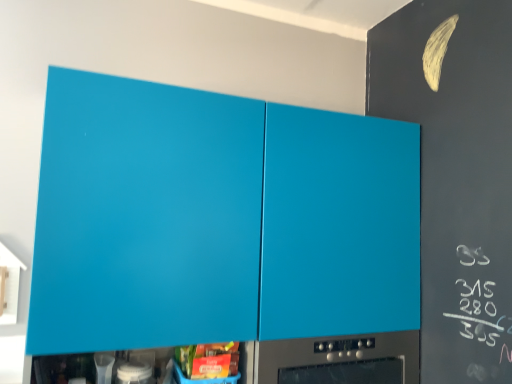
Question: Is matte plastic container at lower center inside the boundaries of matte blue cabinet at upper center, or outside?

Choices:
 (A) inside
 (B) outside

Answer: (A)

Question: Is point (203, 369) closer or farther from the camera than point (346, 155)?

Choices:
 (A) closer
 (B) farther

Answer: (A)

Question: Which of these objects is positioned farthest from the matte blue cabinet at upper center?

Choices:
 (A) white glossy container at lower center
 (B) matte plastic container at lower center
 (C) satin black oven at lower center

Answer: (A)

Question: Estimate the real-world distances between objects in this image. Which object is farther from the matte blue cabinet at upper center?

Choices:
 (A) white glossy container at lower center
 (B) matte plastic container at lower center
 (C) satin black oven at lower center

Answer: (A)